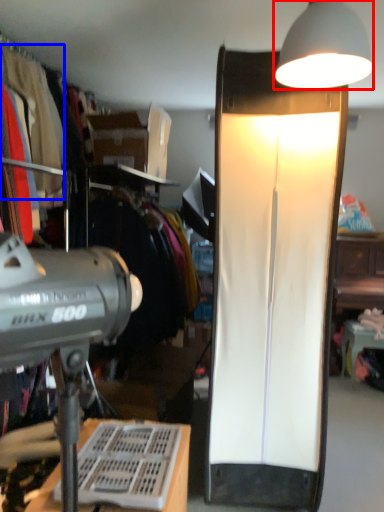
Question: Which object is further to the camera taking this photo, lamp (highlighted by a red box) or clothing (highlighted by a blue box)?

Choices:
 (A) lamp
 (B) clothing

Answer: (B)